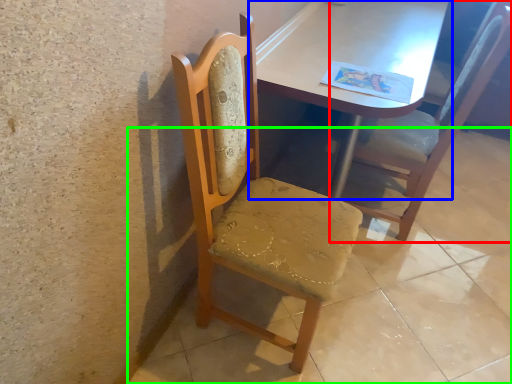
Question: Which object is the closest to the chair (highlighted by a red box)? Choose among these: table (highlighted by a blue box) or concrete (highlighted by a green box).

Choices:
 (A) table
 (B) concrete

Answer: (A)